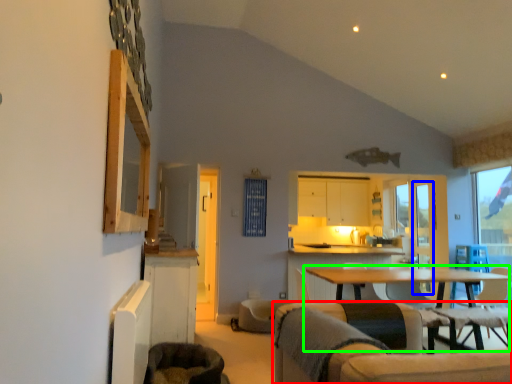
Question: Estimate the real-world distances between objects in this image. Which object is farther from chair (highlighted by a red box), screen door (highlighted by a blue box) or table (highlighted by a green box)?

Choices:
 (A) screen door
 (B) table

Answer: (A)